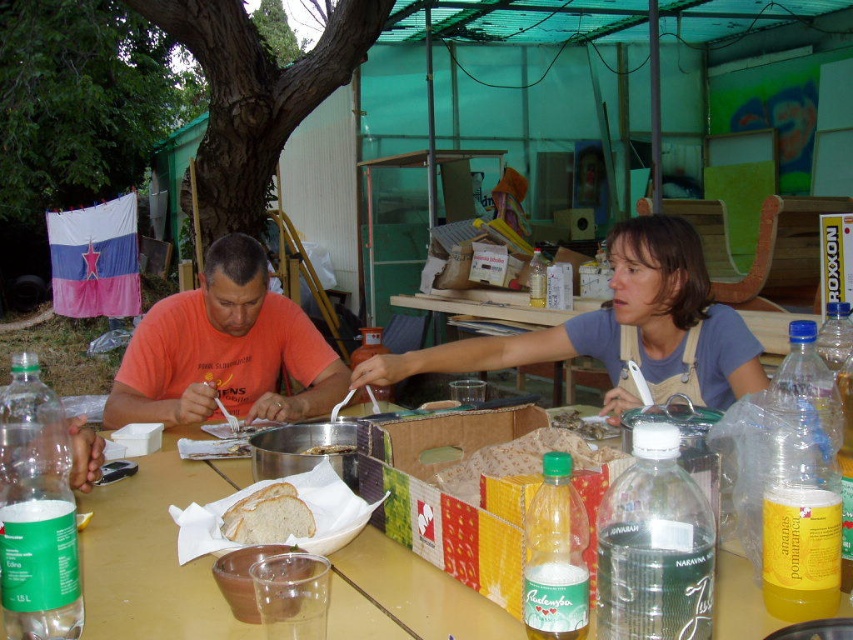
Question: Can you confirm if yellow plastic table at center is positioned to the right of white bread at table center?

Choices:
 (A) no
 (B) yes

Answer: (A)

Question: Which point is farther to the camera?

Choices:
 (A) white soft bread at center
 (B) white bread at table center

Answer: (B)

Question: Which point is farther from the camera taking this photo?

Choices:
 (A) (706, 348)
 (B) (352, 451)
 (C) (306, 522)
 (D) (236, 259)

Answer: (D)

Question: Which point is closer to the camera?

Choices:
 (A) (486, 621)
 (B) (338, 442)

Answer: (A)

Question: Is yellow plastic table at center bigger than white soft bread at center?

Choices:
 (A) no
 (B) yes

Answer: (B)

Question: Can you confirm if yellow plastic table at center is positioned above white soft bread at center?

Choices:
 (A) yes
 (B) no

Answer: (B)